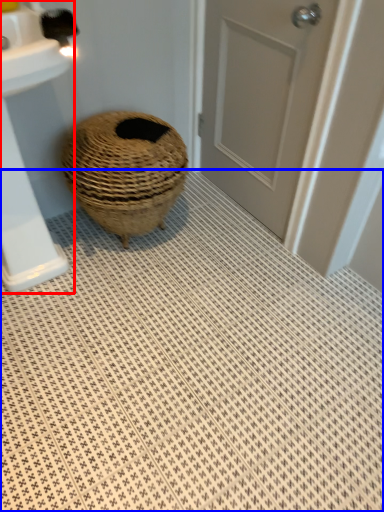
Question: Which point is closer to the camera, sink (highlighted by a red box) or bath mat (highlighted by a blue box)?

Choices:
 (A) sink
 (B) bath mat

Answer: (B)